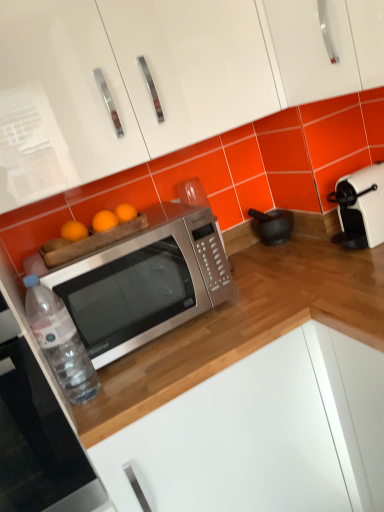
The height and width of the screenshot is (512, 384). What do you see at coordinates (176, 70) in the screenshot?
I see `white glossy cabinet at upper center, positioned as the first cabinetry in top-to-bottom order` at bounding box center [176, 70].

How much space does white glossy cabinet at lower center, arranged as the 2th cabinetry when viewed from the top, occupy vertically?

35.83 inches.

This screenshot has height=512, width=384. I want to click on black matte mortar at lower center, so click(272, 226).

Identify the location of white glossy cabinet at upper center, acting as the 2th cabinetry starting from the bottom. (176, 70).

Considering the positions of objects brushed metal microwave at lower left and clear plastic bottle at lower left in the image provided, who is more to the right, brushed metal microwave at lower left or clear plastic bottle at lower left?

clear plastic bottle at lower left.

Locate an element on the screen. bottle on the right side of brushed metal microwave at lower left is located at coordinates (60, 341).

Is the surface of brushed metal microwave at lower left in direct contact with clear plastic bottle at lower left?

brushed metal microwave at lower left and clear plastic bottle at lower left are not in contact.

The width and height of the screenshot is (384, 512). In the image, there is a white glossy cabinet at lower center, arranged as the 2th cabinetry when viewed from the top. Identify the location of oven above it (from the image's perspective). (37, 436).

Would you say brushed metal microwave at lower left is to the left or to the right of white glossy cabinet at lower center, the first cabinetry ordered from the bottom, in the picture?

Clearly, brushed metal microwave at lower left is on the left of white glossy cabinet at lower center, the first cabinetry ordered from the bottom, in the image.

Is white glossy cabinet at lower center, the first cabinetry ordered from the bottom, surrounded by brushed metal microwave at lower left?

That's incorrect, white glossy cabinet at lower center, the first cabinetry ordered from the bottom, is not inside brushed metal microwave at lower left.

Is white glossy cabinet at upper center, acting as the 2th cabinetry starting from the bottom, located within brushed metal microwave at lower left?

No, brushed metal microwave at lower left does not contain white glossy cabinet at upper center, acting as the 2th cabinetry starting from the bottom.

From a real-world perspective, is brushed metal microwave at lower left above or below white glossy cabinet at upper center, acting as the 2th cabinetry starting from the bottom?

brushed metal microwave at lower left is situated lower than white glossy cabinet at upper center, acting as the 2th cabinetry starting from the bottom, in the real world.

Is brushed metal microwave at lower left oriented towards white glossy cabinet at upper center, positioned as the first cabinetry in top-to-bottom order?

No, brushed metal microwave at lower left is not facing towards white glossy cabinet at upper center, positioned as the first cabinetry in top-to-bottom order.

How many degrees apart are the facing directions of brushed metal microwave at lower left and white glossy cabinet at upper center, acting as the 2th cabinetry starting from the bottom?

The facing directions of brushed metal microwave at lower left and white glossy cabinet at upper center, acting as the 2th cabinetry starting from the bottom, are 0.000645 degrees apart.

Is white glossy cabinet at lower center, the first cabinetry ordered from the bottom, turned away from white glossy cabinet at upper center, positioned as the first cabinetry in top-to-bottom order?

No, white glossy cabinet at lower center, the first cabinetry ordered from the bottom, is not facing away from white glossy cabinet at upper center, positioned as the first cabinetry in top-to-bottom order.

From a real-world perspective, is white glossy cabinet at lower center, arranged as the 2th cabinetry when viewed from the top, positioned under white glossy cabinet at upper center, positioned as the first cabinetry in top-to-bottom order, based on gravity?

Yes, from a real-world perspective, white glossy cabinet at lower center, arranged as the 2th cabinetry when viewed from the top, is under white glossy cabinet at upper center, positioned as the first cabinetry in top-to-bottom order.

Considering the positions of objects white glossy cabinet at lower center, arranged as the 2th cabinetry when viewed from the top, and white glossy cabinet at upper center, acting as the 2th cabinetry starting from the bottom, in the image provided, who is more to the left, white glossy cabinet at lower center, arranged as the 2th cabinetry when viewed from the top, or white glossy cabinet at upper center, acting as the 2th cabinetry starting from the bottom,?

Result: Positioned to the left is white glossy cabinet at upper center, acting as the 2th cabinetry starting from the bottom.

In terms of height, does white plastic toaster at right look taller or shorter compared to satin silver microwave at center?

Clearly, white plastic toaster at right is shorter compared to satin silver microwave at center.

From the image's perspective, is white plastic toaster at right located above satin silver microwave at center?

Yes, from the image's perspective, white plastic toaster at right is above satin silver microwave at center.

Which object is positioned more to the left, white plastic toaster at right or satin silver microwave at center?

From the viewer's perspective, satin silver microwave at center appears more on the left side.

Is white plastic toaster at right not close to satin silver microwave at center?

white plastic toaster at right is actually quite close to satin silver microwave at center.

From the image's perspective, relative to white glossy cabinet at upper center, positioned as the first cabinetry in top-to-bottom order, is clear plastic bottle at lower left above or below?

From the image's perspective, clear plastic bottle at lower left appears below white glossy cabinet at upper center, positioned as the first cabinetry in top-to-bottom order.

Can white glossy cabinet at upper center, positioned as the first cabinetry in top-to-bottom order, be found inside clear plastic bottle at lower left?

No.

Between clear plastic bottle at lower left and white glossy cabinet at upper center, positioned as the first cabinetry in top-to-bottom order, which one has less height?

clear plastic bottle at lower left.

Which object is further away from the camera taking this photo, clear plastic bottle at lower left or white glossy cabinet at upper center, positioned as the first cabinetry in top-to-bottom order?

Positioned behind is clear plastic bottle at lower left.

Is point (240, 4) positioned after point (97, 260)?

Yes, point (240, 4) is farther from viewer.

How much distance is there between white glossy cabinet at upper center, positioned as the first cabinetry in top-to-bottom order, and satin silver microwave at center?

white glossy cabinet at upper center, positioned as the first cabinetry in top-to-bottom order, and satin silver microwave at center are 14.12 inches apart.

Is white glossy cabinet at upper center, positioned as the first cabinetry in top-to-bottom order, bigger than satin silver microwave at center?

Indeed, white glossy cabinet at upper center, positioned as the first cabinetry in top-to-bottom order, has a larger size compared to satin silver microwave at center.

Considering the relative positions of white glossy cabinet at upper center, acting as the 2th cabinetry starting from the bottom, and satin silver microwave at center in the image provided, is white glossy cabinet at upper center, acting as the 2th cabinetry starting from the bottom, behind satin silver microwave at center?

No, it is not.

The image size is (384, 512). I want to click on bottle on the right of brushed metal microwave at lower left, so click(x=60, y=341).

This screenshot has width=384, height=512. Identify the location of oven above the white glossy cabinet at lower center, the first cabinetry ordered from the bottom (from a real-world perspective). (37, 436).

Looking at this image, based on their spatial positions, is white glossy cabinet at lower center, arranged as the 2th cabinetry when viewed from the top, or satin silver microwave at center closer to brushed metal microwave at lower left?

satin silver microwave at center is positioned closer to the anchor brushed metal microwave at lower left.

Looking at the image, which one is located closer to white glossy cabinet at upper center, acting as the 2th cabinetry starting from the bottom, white plastic toaster at right or black matte mortar at lower center?

The object closer to white glossy cabinet at upper center, acting as the 2th cabinetry starting from the bottom, is white plastic toaster at right.

Based on their spatial positions, is brushed metal microwave at lower left or white glossy cabinet at upper center, acting as the 2th cabinetry starting from the bottom, closer to white plastic toaster at right?

Based on the image, white glossy cabinet at upper center, acting as the 2th cabinetry starting from the bottom, appears to be nearer to white plastic toaster at right.

Considering their positions, is black matte mortar at lower center positioned further to clear plastic bottle at lower left than white glossy cabinet at lower center, the first cabinetry ordered from the bottom?

The object further to clear plastic bottle at lower left is black matte mortar at lower center.

Which object lies nearer to the anchor point clear plastic bottle at lower left, white glossy cabinet at lower center, arranged as the 2th cabinetry when viewed from the top, or white glossy cabinet at upper center, acting as the 2th cabinetry starting from the bottom?

The object closer to clear plastic bottle at lower left is white glossy cabinet at lower center, arranged as the 2th cabinetry when viewed from the top.

Considering their positions, is satin silver microwave at center positioned closer to white plastic toaster at right than white glossy cabinet at upper center, acting as the 2th cabinetry starting from the bottom?

white glossy cabinet at upper center, acting as the 2th cabinetry starting from the bottom, lies closer to white plastic toaster at right than the other object.

Looking at this image, looking at the image, which one is located closer to satin silver microwave at center, clear plastic bottle at lower left or white glossy cabinet at upper center, acting as the 2th cabinetry starting from the bottom?

Based on the image, clear plastic bottle at lower left appears to be nearer to satin silver microwave at center.

Considering their positions, is white glossy cabinet at lower center, the first cabinetry ordered from the bottom, positioned closer to satin silver microwave at center than clear plastic bottle at lower left?

clear plastic bottle at lower left is positioned closer to the anchor satin silver microwave at center.

Identify the location of appliance between white glossy cabinet at upper center, positioned as the first cabinetry in top-to-bottom order, and white glossy cabinet at lower center, arranged as the 2th cabinetry when viewed from the top, vertically. (272, 226).

Where is `appliance located between clear plastic bottle at lower left and white plastic toaster at right in the left-right direction`? The height and width of the screenshot is (512, 384). appliance located between clear plastic bottle at lower left and white plastic toaster at right in the left-right direction is located at coordinates (272, 226).

The width and height of the screenshot is (384, 512). I want to click on bottle between white glossy cabinet at upper center, acting as the 2th cabinetry starting from the bottom, and brushed metal microwave at lower left in the up-down direction, so click(60, 341).

Locate an element on the screen. The height and width of the screenshot is (512, 384). microwave oven between white glossy cabinet at upper center, positioned as the first cabinetry in top-to-bottom order, and white glossy cabinet at lower center, the first cabinetry ordered from the bottom, from top to bottom is located at coordinates click(x=143, y=281).